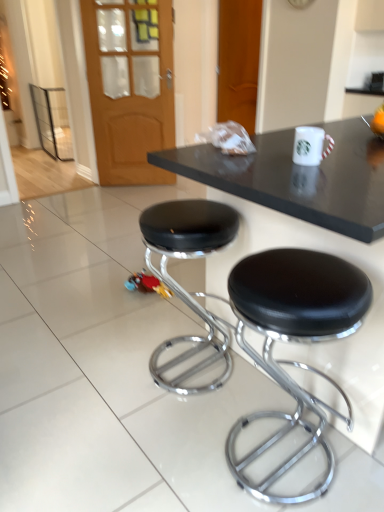
Find the location of `blank space above black leather stool at center, which ranks as the 1th stool in left-to-right order (from a real-world perspective)`. blank space above black leather stool at center, which ranks as the 1th stool in left-to-right order (from a real-world perspective) is located at coordinates (198, 218).